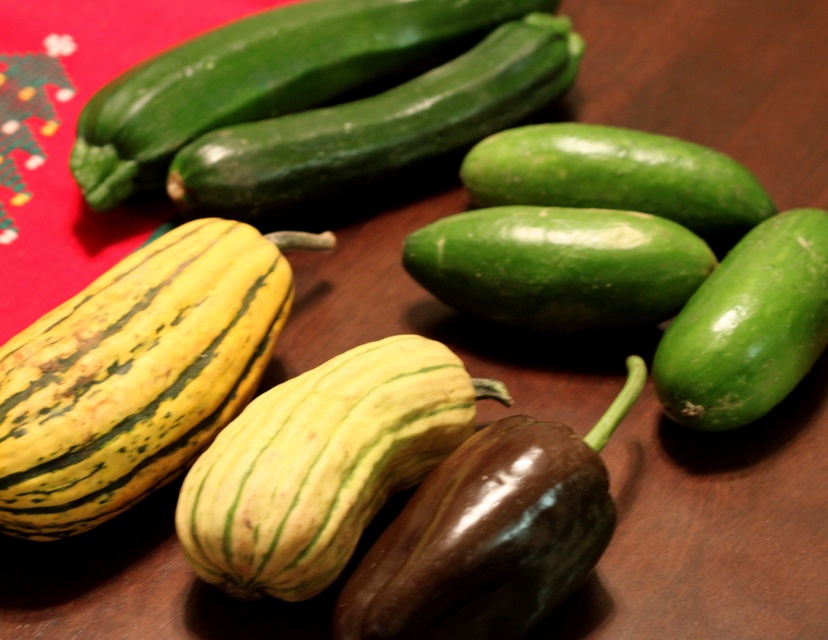
Between point (282, 307) and point (559, 60), which one is positioned behind?

The point (559, 60) is more distant.

Which is above, yellow-green striped squash at left or green smooth cucumber at upper center?

green smooth cucumber at upper center is higher up.

Locate an element on the screen. The width and height of the screenshot is (828, 640). yellow-green striped squash at left is located at coordinates (137, 372).

Between point (330, 188) and point (482, 298), which one is positioned in front?

Point (482, 298) is more forward.

The image size is (828, 640). I want to click on green smooth cucumber at upper center, so click(378, 125).

Between shiny dark purple eggplant at center and green smooth cucumber at center, which one is positioned lower?

shiny dark purple eggplant at center

You are a GUI agent. You are given a task and a screenshot of the screen. Output one action in this format:
    pyautogui.click(x=<x>, y=<y>)
    Task: Click on the shiny dark purple eggplant at center
    Image resolution: width=828 pixels, height=640 pixels.
    Given the screenshot: What is the action you would take?
    pyautogui.click(x=490, y=532)